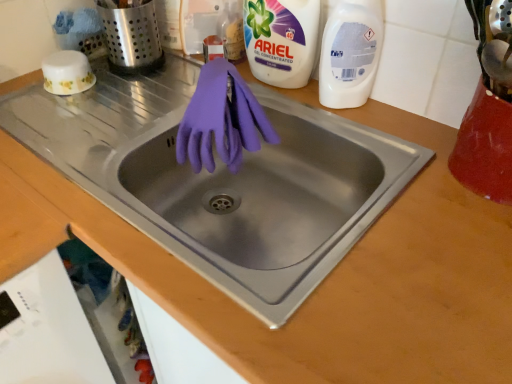
Locate an element on the screen. free space in front of brushed metal utensil holder at upper left is located at coordinates (122, 105).